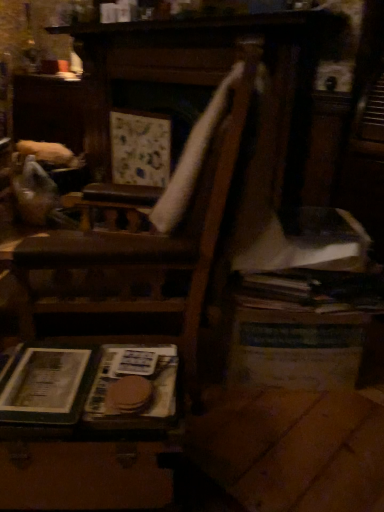
What are the coordinates of `free space above brown paper at lower left, the first paperback book positioned from the right (from a real-world perspective)` in the screenshot? It's located at (140, 366).